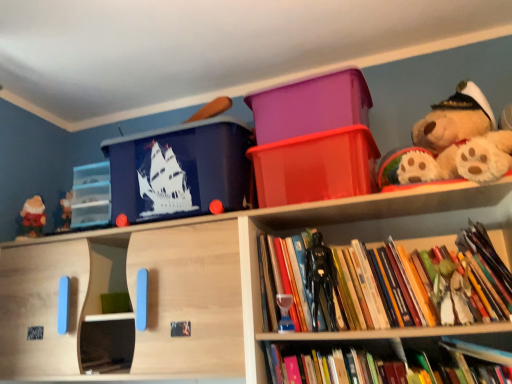
Question: From a real-world perspective, is translucent glass hourglass at center, placed as the 3th toy when sorted from front to back, located higher than transparent plastic drawers at left, which is the fourth storage box in right-to-left order?

Choices:
 (A) yes
 (B) no

Answer: (B)

Question: Is transparent plastic drawers at left, which ranks as the 1th storage box in left-to-right order, at the back of translucent glass hourglass at center, placed as the 3th toy when sorted from front to back?

Choices:
 (A) no
 (B) yes

Answer: (A)

Question: Is translucent glass hourglass at center, which is the second toy from back to front, outside of transparent plastic drawers at left, which is the fourth storage box in right-to-left order?

Choices:
 (A) yes
 (B) no

Answer: (A)

Question: Is translucent glass hourglass at center, which is the second toy from back to front, further to camera compared to transparent plastic drawers at left, which ranks as the 1th storage box in left-to-right order?

Choices:
 (A) no
 (B) yes

Answer: (A)

Question: Is translucent glass hourglass at center, positioned as the second toy in left-to-right order, smaller than transparent plastic drawers at left, which is the fourth storage box in right-to-left order?

Choices:
 (A) yes
 (B) no

Answer: (A)

Question: From a real-world perspective, relative to matte red santa at left, which appears as the first toy when viewed from the back, is transparent plastic drawers at left, which ranks as the 1th storage box in left-to-right order, vertically above or below?

Choices:
 (A) above
 (B) below

Answer: (A)

Question: In the image, is transparent plastic drawers at left, which is the fourth storage box in right-to-left order, positioned in front of or behind matte red santa at left, which appears as the first toy when viewed from the back?

Choices:
 (A) front
 (B) behind

Answer: (A)

Question: From the image's perspective, is transparent plastic drawers at left, which ranks as the 1th storage box in left-to-right order, positioned above or below matte red santa at left, which appears as the fourth toy when viewed from the front?

Choices:
 (A) above
 (B) below

Answer: (A)

Question: From their relative heights in the image, would you say transparent plastic drawers at left, which is the fourth storage box in right-to-left order, is taller or shorter than matte red santa at left, which appears as the first toy when viewed from the back?

Choices:
 (A) short
 (B) tall

Answer: (B)

Question: Is transparent plastic drawers at left, which is the fourth storage box in right-to-left order, bigger or smaller than purple plastic bin at upper center, which is the 2th storage box in right-to-left order?

Choices:
 (A) big
 (B) small

Answer: (B)

Question: From the image's perspective, is transparent plastic drawers at left, which is the fourth storage box in right-to-left order, located above or below purple plastic bin at upper center, which is the 2th storage box in right-to-left order?

Choices:
 (A) above
 (B) below

Answer: (B)

Question: Considering the positions of transparent plastic drawers at left, which ranks as the 1th storage box in left-to-right order, and purple plastic bin at upper center, the third storage box positioned from the left, in the image, is transparent plastic drawers at left, which ranks as the 1th storage box in left-to-right order, taller or shorter than purple plastic bin at upper center, the third storage box positioned from the left,?

Choices:
 (A) tall
 (B) short

Answer: (A)

Question: Is point (105, 205) closer or farther from the camera than point (329, 112)?

Choices:
 (A) closer
 (B) farther

Answer: (B)

Question: Looking at their shapes, would you say black plastic action figure at center, which ranks as the second toy in right-to-left order, is wider or thinner than matte blue plastic storage box at upper left, arranged as the 3th storage box when viewed from the right?

Choices:
 (A) thin
 (B) wide

Answer: (A)

Question: Visually, is black plastic action figure at center, the second toy positioned from the front, positioned to the left or to the right of matte blue plastic storage box at upper left, arranged as the 3th storage box when viewed from the right?

Choices:
 (A) left
 (B) right

Answer: (B)